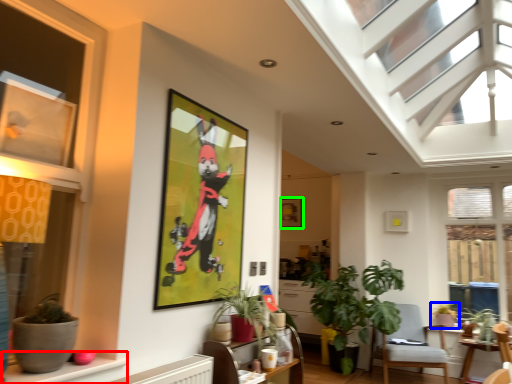
Question: Which object is the closest to the window sill (highlighted by a red box)? Choose among these: houseplant (highlighted by a blue box) or picture frame (highlighted by a green box).

Choices:
 (A) houseplant
 (B) picture frame

Answer: (B)